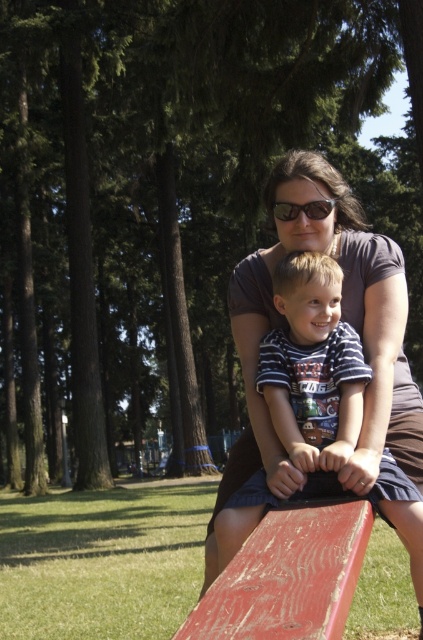
You are standing at the center of the park and want to locate the matte brown shirt at center. According to the coordinates given, where should you look?

The matte brown shirt at center is located at the coordinates point (343, 320), so you should look towards the center of the image where those coordinates point to.

You are a parent at the park and want to ensure both children on the seesaw are balanced. The seesaw has a central pivot point. Given that the matte brown shirt at center is worn by a child and the striped cotton shirt at center is worn by another child, which child should sit closer to the pivot point to balance the seesaw?

The matte brown shirt at center has a lesser width compared to striped cotton shirt at center. To balance the seesaw, the child wearing the matte brown shirt at center should sit closer to the pivot point because they are likely lighter, requiring a shorter distance from the pivot to balance the heavier child in the striped cotton shirt at center.

You are a photographer taking a picture of the striped cotton shirt at center and the matte black sunglasses at center. Which object will appear larger in the photo?

The striped cotton shirt at center will appear larger in the photo because it is closer to the camera than the matte black sunglasses at center.